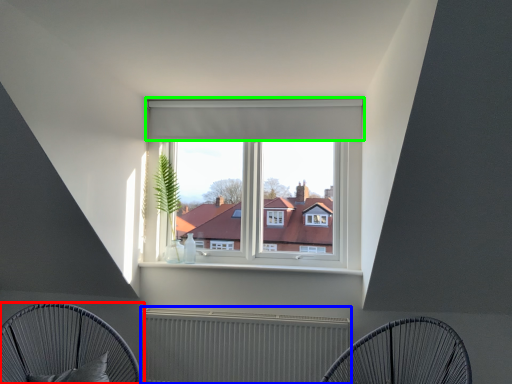
Question: Which object is positioned closest to furniture (highlighted by a red box)? Select from radiator (highlighted by a blue box) and curtain (highlighted by a green box).

Choices:
 (A) radiator
 (B) curtain

Answer: (A)